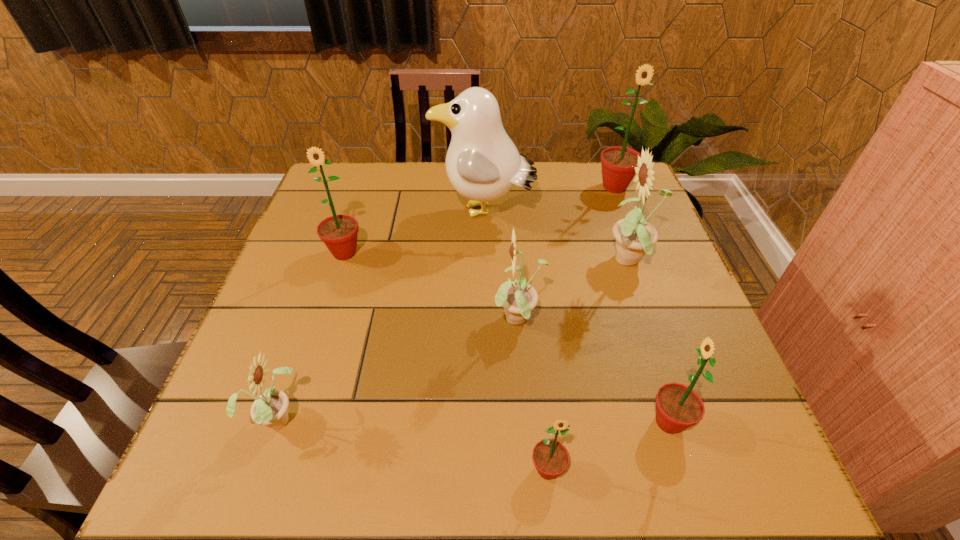
The width and height of the screenshot is (960, 540). In order to click on free space between the third biggest green sunflower and the nearest object in this screenshot , I will do `click(608, 446)`.

Find the location of a particular element. Image resolution: width=960 pixels, height=540 pixels. vacant area that lies between the tallest sunflower and the white gull is located at coordinates (549, 200).

The width and height of the screenshot is (960, 540). I want to click on free area in between the gull and the farthest green sunflower, so tap(549, 200).

You are a GUI agent. You are given a task and a screenshot of the screen. Output one action in this format:
    pyautogui.click(x=<x>, y=<y>)
    Task: Click on the free space between the second yellow sunflower from left to right and the leftmost green sunflower
    The image size is (960, 540).
    Given the screenshot: What is the action you would take?
    pyautogui.click(x=432, y=287)

Find the location of `free space between the fifth farthest object and the gull`. free space between the fifth farthest object and the gull is located at coordinates (x=501, y=267).

Identify the location of free spot between the third nearest green sunflower and the nearest object. (446, 361).

In order to click on vacant space that is in between the second farthest green sunflower and the smallest yellow sunflower in this screenshot , I will do pos(311,335).

At what (x,y) coordinates should I click in order to perform the action: click on vacant area that lies between the third farthest green sunflower and the farthest green sunflower. Please return your answer as a coordinate pair (x, y). Image resolution: width=960 pixels, height=540 pixels. Looking at the image, I should click on (641, 305).

In order to click on vacant point located between the biggest green sunflower and the smallest yellow sunflower in this screenshot , I will do `click(446, 302)`.

What are the coordinates of `object that is the fifth closest to the second nearest green sunflower` in the screenshot? It's located at (270, 408).